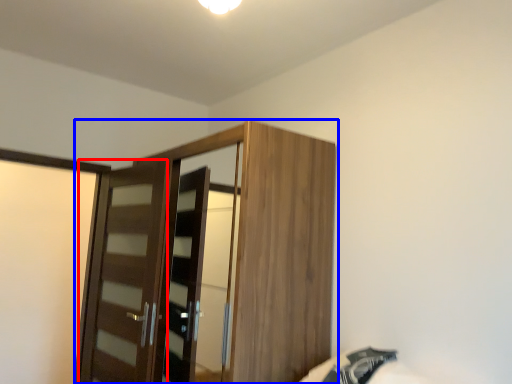
Question: Which point is closer to the camera, door (highlighted by a red box) or cupboard (highlighted by a blue box)?

Choices:
 (A) door
 (B) cupboard

Answer: (B)